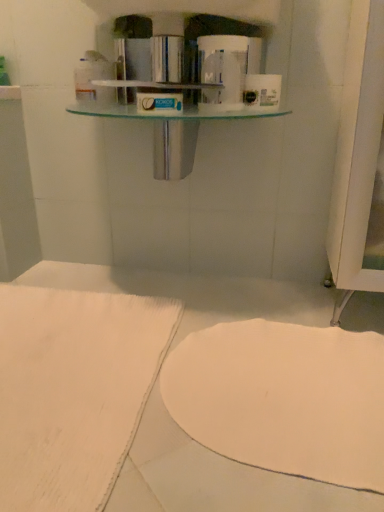
Question: Is white glossy toilet paper at upper center, which is the second toilet paper from right to left, further to the viewer compared to white fabric at lower left?

Choices:
 (A) yes
 (B) no

Answer: (A)

Question: Does white glossy toilet paper at upper center, placed as the 1th toilet paper when sorted from left to right, have a greater width compared to white fabric at lower left?

Choices:
 (A) no
 (B) yes

Answer: (A)

Question: Does white glossy toilet paper at upper center, placed as the 1th toilet paper when sorted from left to right, have a lesser height compared to white fabric at lower left?

Choices:
 (A) yes
 (B) no

Answer: (B)

Question: Considering the relative positions of white glossy toilet paper at upper center, placed as the 1th toilet paper when sorted from left to right, and white fabric at lower left in the image provided, is white glossy toilet paper at upper center, placed as the 1th toilet paper when sorted from left to right, to the right of white fabric at lower left from the viewer's perspective?

Choices:
 (A) yes
 (B) no

Answer: (A)

Question: From a real-world perspective, is white glossy toilet paper at upper center, placed as the 1th toilet paper when sorted from left to right, below white fabric at lower left?

Choices:
 (A) no
 (B) yes

Answer: (A)

Question: Looking at the image, does white matte toilet paper at upper center, the 2th toilet paper in the left-to-right sequence, seem bigger or smaller compared to white fabric at lower left?

Choices:
 (A) big
 (B) small

Answer: (B)

Question: Considering their positions, is white matte toilet paper at upper center, the 1th toilet paper from the right, located in front of or behind white fabric at lower left?

Choices:
 (A) front
 (B) behind

Answer: (B)

Question: Is white matte toilet paper at upper center, the 2th toilet paper in the left-to-right sequence, wider or thinner than white fabric at lower left?

Choices:
 (A) wide
 (B) thin

Answer: (B)

Question: Does point click(276, 102) appear closer or farther from the camera than point click(92, 449)?

Choices:
 (A) farther
 (B) closer

Answer: (A)

Question: Is white fabric at lower left inside the boundaries of white matte towel at lower center, or outside?

Choices:
 (A) outside
 (B) inside

Answer: (A)

Question: Considering the positions of white fabric at lower left and white matte towel at lower center in the image, is white fabric at lower left taller or shorter than white matte towel at lower center?

Choices:
 (A) short
 (B) tall

Answer: (B)

Question: In terms of width, does white fabric at lower left look wider or thinner when compared to white matte towel at lower center?

Choices:
 (A) wide
 (B) thin

Answer: (A)

Question: From the image's perspective, relative to white matte towel at lower center, is white fabric at lower left above or below?

Choices:
 (A) below
 (B) above

Answer: (B)

Question: In the image, is white fabric at lower left on the left side or the right side of white matte toilet paper at upper center, the 2th toilet paper in the left-to-right sequence?

Choices:
 (A) left
 (B) right

Answer: (A)

Question: In terms of width, does white fabric at lower left look wider or thinner when compared to white matte toilet paper at upper center, the 1th toilet paper from the right?

Choices:
 (A) thin
 (B) wide

Answer: (B)